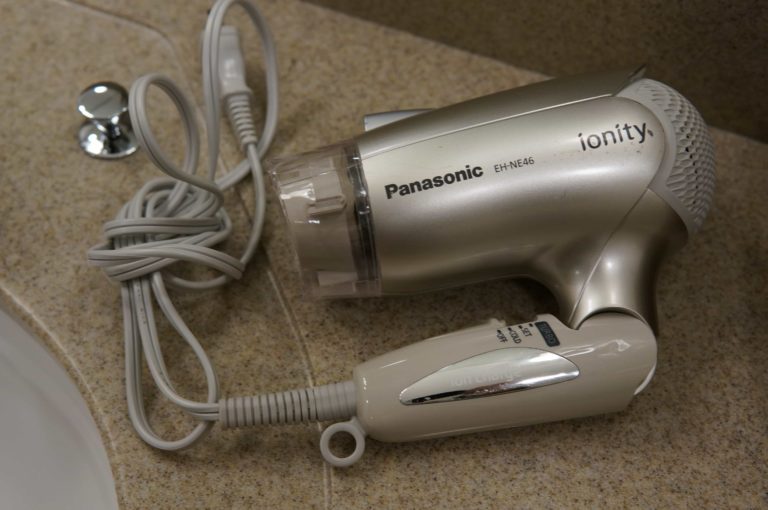
Locate an element on the screen. The width and height of the screenshot is (768, 510). attachment for dryer is located at coordinates (313, 222).